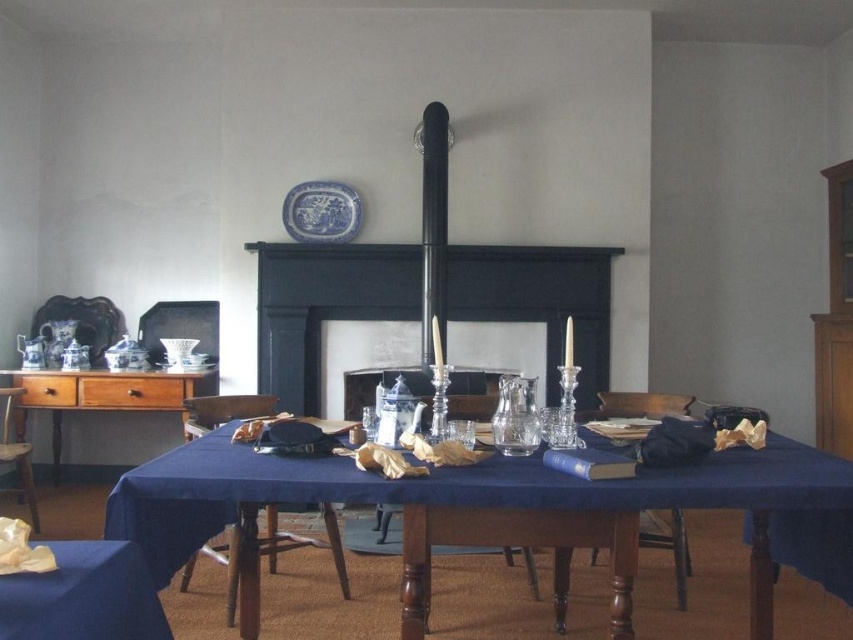
Question: Among these points, which one is farthest from the camera?

Choices:
 (A) (503, 522)
 (B) (183, 589)
 (C) (582, 273)
 (D) (85, 566)

Answer: (C)

Question: Can you confirm if smooth wooden table at center is thinner than black matte fireplace at center?

Choices:
 (A) no
 (B) yes

Answer: (B)

Question: Among these points, which one is farthest from the camera?

Choices:
 (A) (428, 148)
 (B) (28, 592)

Answer: (A)

Question: Which of the following is the closest to the observer?

Choices:
 (A) (4, 445)
 (B) (234, 419)
 (C) (163, 388)
 (D) (48, 592)

Answer: (D)

Question: In this image, where is smooth wooden table at center located relative to black matte fireplace at center?

Choices:
 (A) above
 (B) below

Answer: (B)

Question: In this image, where is blue fabric tablecloth at lower left located relative to wooden chair at lower right?

Choices:
 (A) right
 (B) left

Answer: (B)